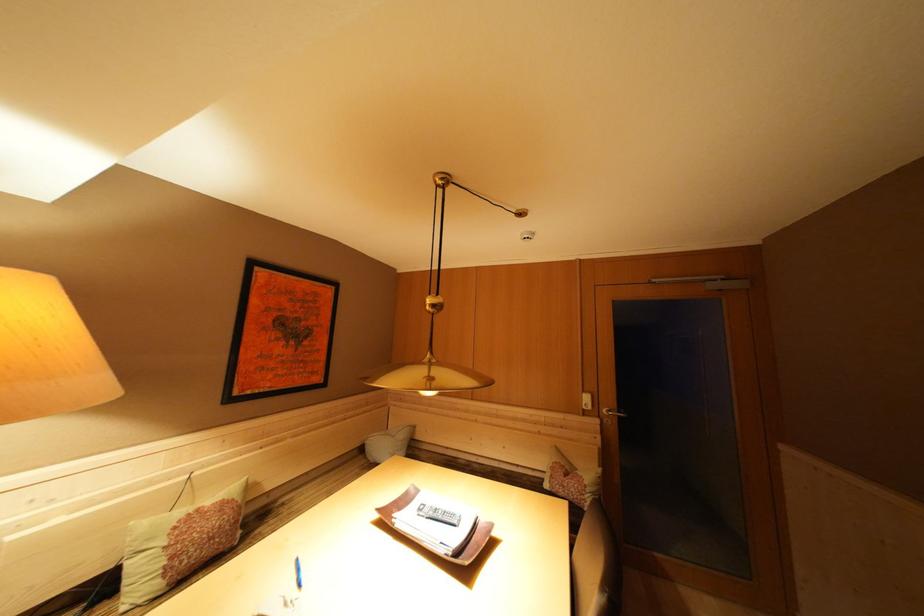
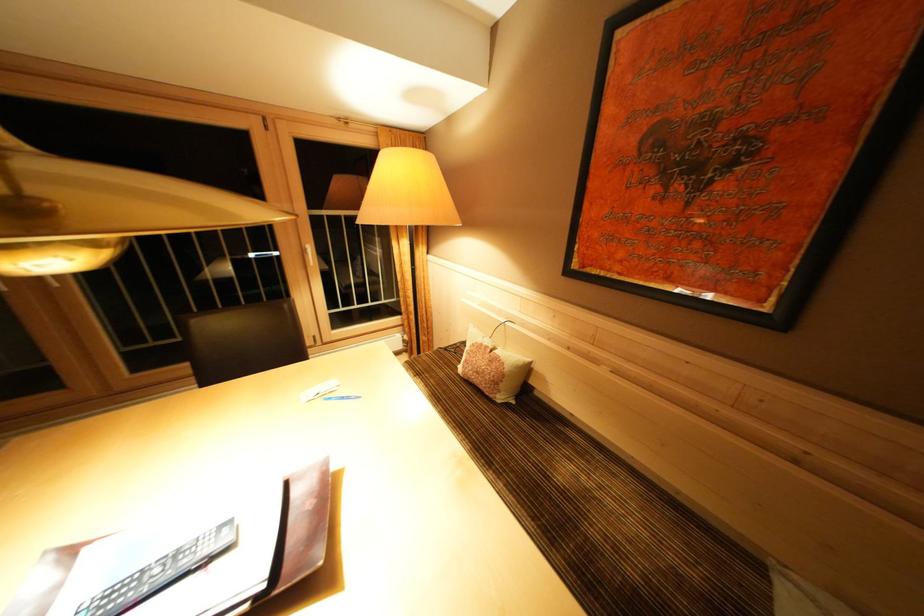
Where in the second image is the point corresponding to [290,509] from the first image?

(565, 438)